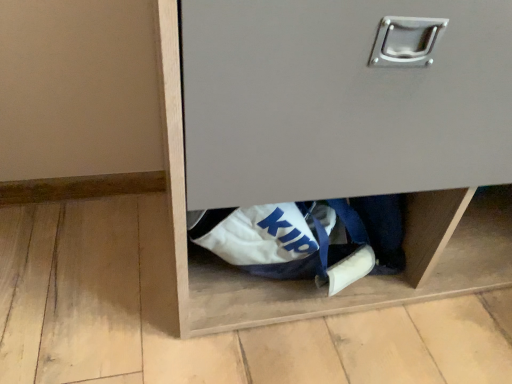
Where is `matte gray drawer at lower center`? This screenshot has height=384, width=512. matte gray drawer at lower center is located at coordinates (343, 97).

The width and height of the screenshot is (512, 384). Describe the element at coordinates (343, 97) in the screenshot. I see `matte gray drawer at lower center` at that location.

Based on the photo, what is the approximate width of matte gray drawer at lower center?

It is 15.30 inches.

In order to face matte gray drawer at lower center, should I rotate leftwards or rightwards?

Rotate your view right by about 21.314°.

Measure the distance between point [225,135] and camera.

Point [225,135] and camera are 18.46 inches apart.

At what (x,y) coordinates should I click in order to perform the action: click on matte gray drawer at lower center. Please return your answer as a coordinate pair (x, y). Looking at the image, I should click on (343, 97).